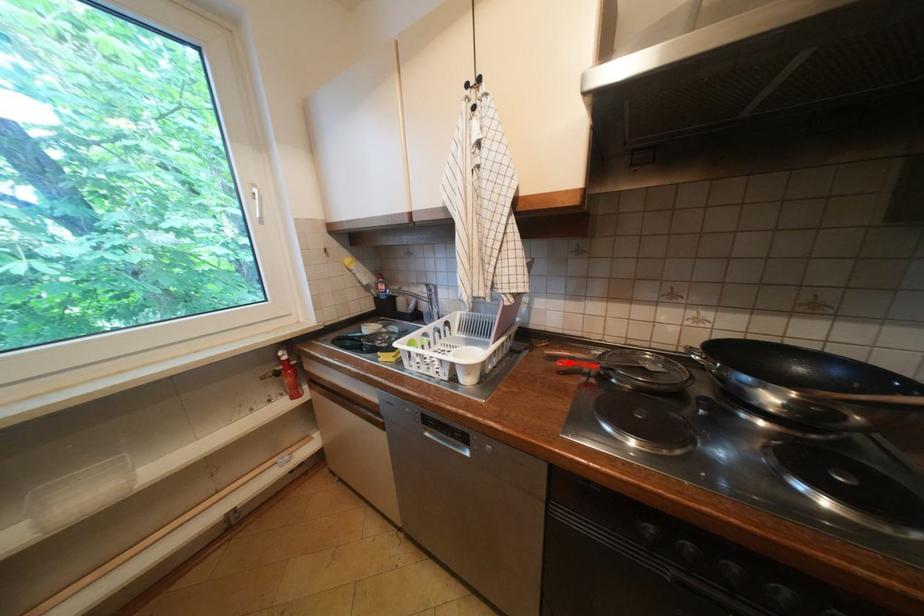
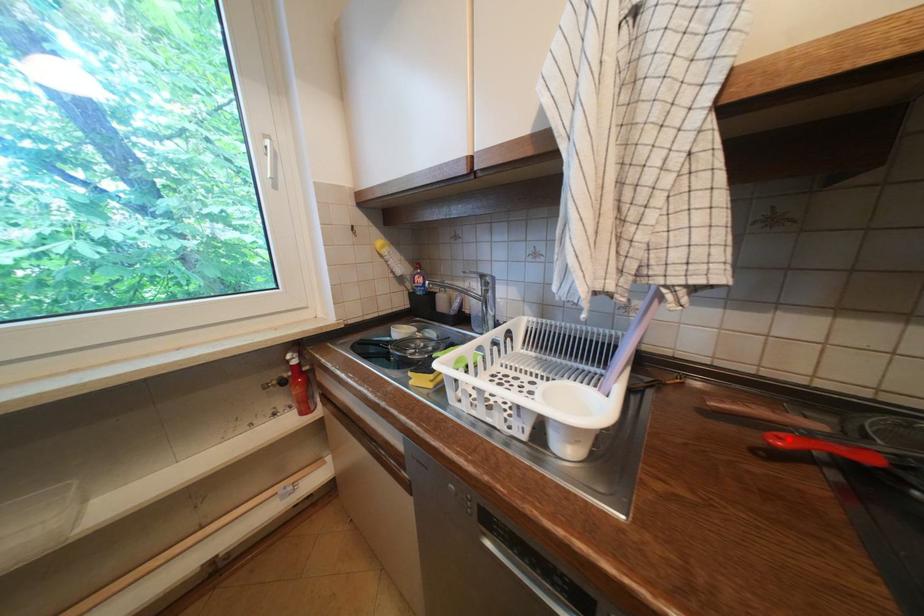
I am providing you with two images of the same scene from different viewpoints. A red point is marked on the first image and another point is marked on the second image. Are the points marked in image1 and image2 representing the same 3D position?

Yes